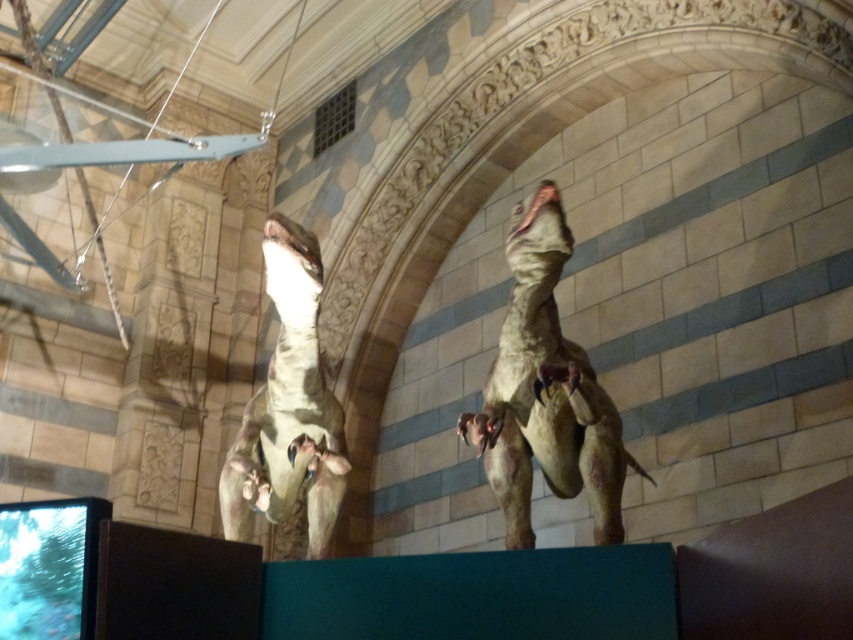
You are a visitor standing in the museum hall. You notice two matte brown dinosaurs in the exhibit. Which one is positioned closer to you, the matte brown dinosaur at upper center or the matte brown dinosaur at left?

The matte brown dinosaur at upper center is closer to the viewer than the matte brown dinosaur at left.

You are a visitor in the museum and want to take a photo of both the matte brown dinosaur at upper center and the matte brown dinosaur at left. Which dinosaur should you stand closer to in order to capture both in a single frame without zooming?

You should stand closer to the matte brown dinosaur at upper center because it is shorter than the matte brown dinosaur at left, allowing both to fit within the frame when positioned appropriately.

You are a museum visitor standing in the center of the hall. You want to take a photo of both the matte brown dinosaur at upper center and the matte brown dinosaur at left in the same frame. The camera you have can capture objects within a 10 meter range. Will both dinosaurs fit in the photo?

The matte brown dinosaur at upper center is 7.60 meters from the matte brown dinosaur at left. Since the camera can capture objects within a 10 meter range, both dinosaurs will fit in the photo as the distance between them is less than the camera range.